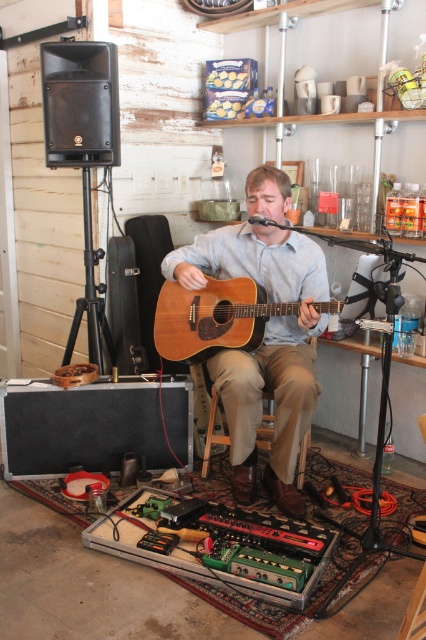
Question: Which of the following is the farthest from the observer?

Choices:
 (A) (262, 266)
 (B) (241, 346)

Answer: (A)

Question: Is wooden acoustic guitar at center further to the viewer compared to natural wood acoustic guitar at center?

Choices:
 (A) yes
 (B) no

Answer: (A)

Question: In this image, where is wooden acoustic guitar at center located relative to natural wood acoustic guitar at center?

Choices:
 (A) below
 (B) above

Answer: (A)

Question: Which of the following is the farthest from the observer?

Choices:
 (A) (207, 339)
 (B) (270, 483)

Answer: (B)

Question: Is wooden acoustic guitar at center thinner than natural wood acoustic guitar at center?

Choices:
 (A) yes
 (B) no

Answer: (A)